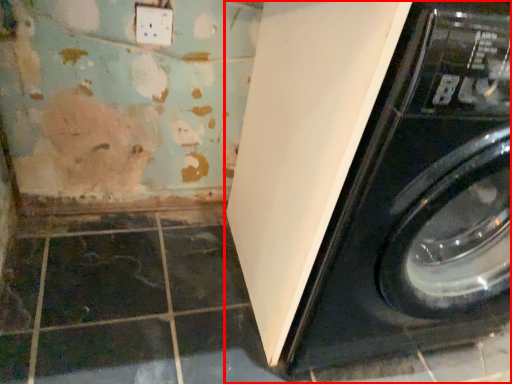
Question: Where is washing machine (annotated by the red box) located in relation to electric outlet in the image?

Choices:
 (A) right
 (B) left

Answer: (A)